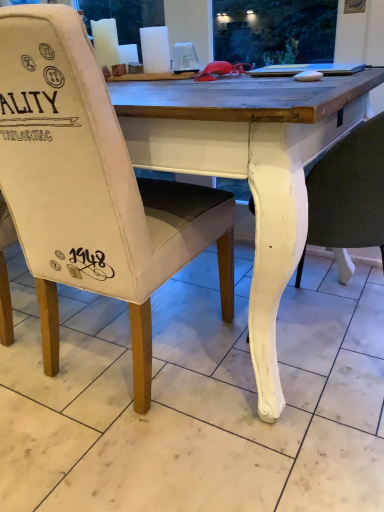
Question: From a real-world perspective, is canvas chair at center, placed as the second chair when sorted from right to left, above or below white painted wood chair at lower right, placed as the second chair when sorted from left to right?

Choices:
 (A) above
 (B) below

Answer: (A)

Question: Is canvas chair at center, acting as the first chair starting from the left, spatially inside white painted wood chair at lower right, placed as the second chair when sorted from left to right, or outside of it?

Choices:
 (A) outside
 (B) inside

Answer: (A)

Question: Which object is the farthest from the canvas chair at center, acting as the first chair starting from the left?

Choices:
 (A) white marble tile at lower center
 (B) white painted wood chair at lower right, which appears as the first chair when viewed from the right

Answer: (B)

Question: Which object is the closest to the canvas chair at center, placed as the second chair when sorted from right to left?

Choices:
 (A) white marble tile at lower center
 (B) white painted wood chair at lower right, which appears as the first chair when viewed from the right

Answer: (A)